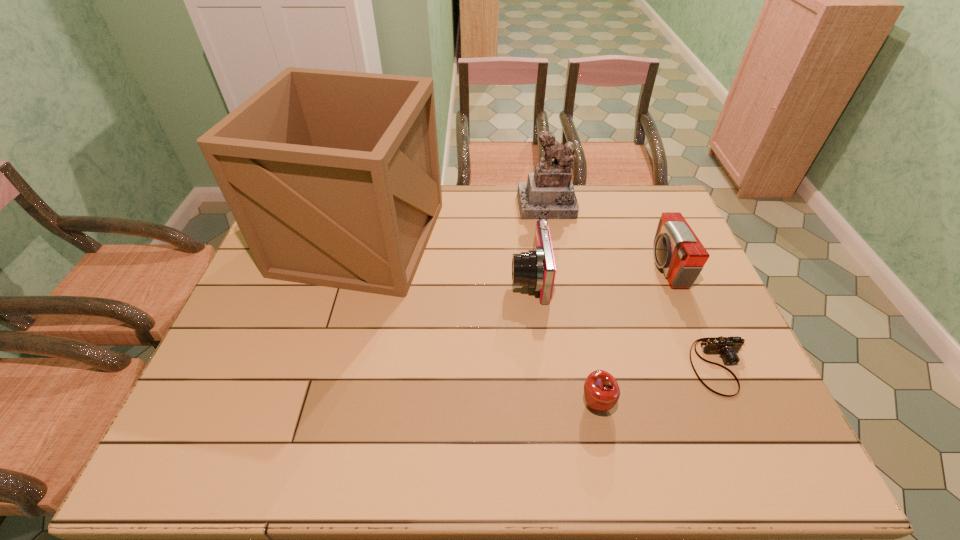
Image resolution: width=960 pixels, height=540 pixels. I want to click on vacant region located on the front-facing side of the leftmost camera, so click(487, 278).

Locate an element on the screen. The height and width of the screenshot is (540, 960). vacant space located on the front-facing side of the leftmost camera is located at coordinates (491, 278).

Where is `free space located on the back of the second shortest object`? This screenshot has width=960, height=540. free space located on the back of the second shortest object is located at coordinates (572, 281).

Find the location of `vacant space located 0.150m on the front-facing side of the shortest camera`. vacant space located 0.150m on the front-facing side of the shortest camera is located at coordinates (760, 460).

Locate an element on the screen. This screenshot has width=960, height=540. box located at the far edge is located at coordinates (333, 178).

This screenshot has width=960, height=540. In order to click on figurine located at the far edge in this screenshot , I will do `click(549, 193)`.

I want to click on object present at the left edge, so click(x=333, y=178).

At what (x,y) coordinates should I click in order to perform the action: click on object situated at the far left corner. Please return your answer as a coordinate pair (x, y). The width and height of the screenshot is (960, 540). Looking at the image, I should click on (333, 178).

What are the coordinates of `free region at the far edge of the desktop` in the screenshot? It's located at (576, 186).

This screenshot has height=540, width=960. In order to click on blank space at the near edge of the desktop in this screenshot , I will do `click(661, 452)`.